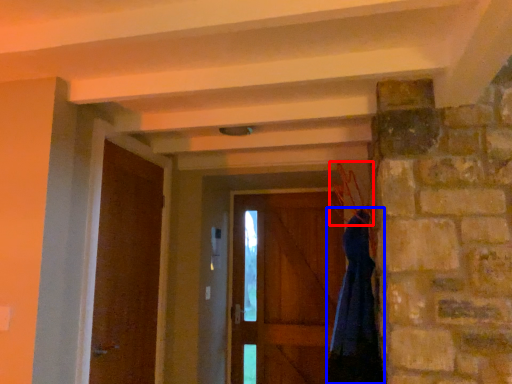
Question: Which of the following is the farthest to the observer, hanger (highlighted by a red box) or dress (highlighted by a blue box)?

Choices:
 (A) hanger
 (B) dress

Answer: (B)